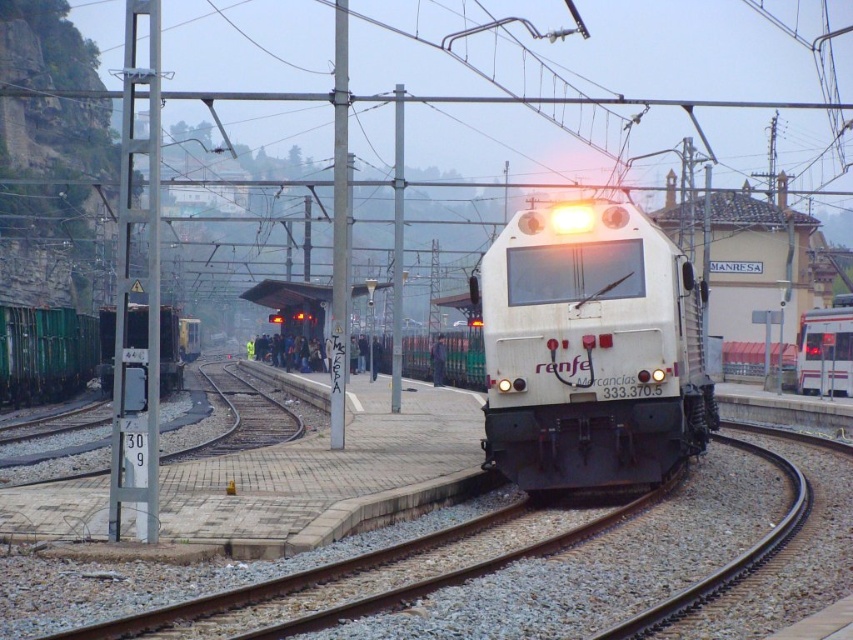
Question: Can you confirm if white matte locomotive at center is thinner than white glossy train at center?

Choices:
 (A) no
 (B) yes

Answer: (A)

Question: Which of these objects is positioned farthest from the white matte locomotive at center?

Choices:
 (A) white glossy train at center
 (B) green matte freight car at left

Answer: (A)

Question: Among these points, which one is farthest from the camera?

Choices:
 (A) (552, 397)
 (B) (840, 387)
 (C) (70, 339)

Answer: (C)

Question: Is green matte freight car at left positioned behind white glossy train at center?

Choices:
 (A) no
 (B) yes

Answer: (A)

Question: Which object is positioned farthest from the green matte freight car at left?

Choices:
 (A) white matte locomotive at center
 (B) white glossy train at center

Answer: (B)

Question: Does green matte freight car at left have a lesser width compared to white glossy train at center?

Choices:
 (A) no
 (B) yes

Answer: (A)